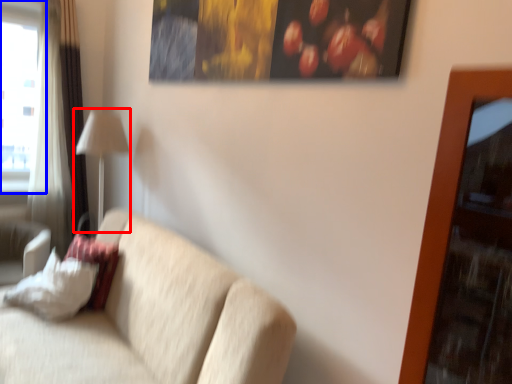
Question: Which object is closer to the camera taking this photo, table lamp (highlighted by a red box) or window (highlighted by a blue box)?

Choices:
 (A) table lamp
 (B) window

Answer: (A)